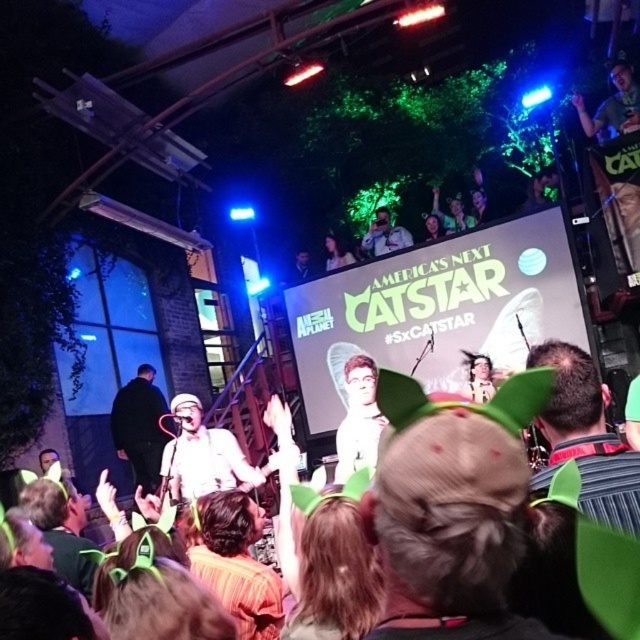
Question: Which of the following is the farthest from the observer?

Choices:
 (A) (595, 448)
 (B) (204, 432)
 (C) (374, 378)

Answer: (B)

Question: Is striped shirt at lower center bigger than smooth white shirt at center?

Choices:
 (A) no
 (B) yes

Answer: (A)

Question: Is striped shirt at lower center above white matte microphone at center?

Choices:
 (A) yes
 (B) no

Answer: (A)

Question: Which point appears closest to the camera in this image?

Choices:
 (A) (234, 460)
 (B) (348, 477)
 (C) (563, 417)
 (D) (124, 413)

Answer: (C)

Question: Which is nearer to the striped shirt at lower center?

Choices:
 (A) white matte microphone at center
 (B) dark brown hair at center
 (C) smooth white shirt at center
 (D) dark gray fabric jacket at center

Answer: (C)

Question: Does dark brown hair at center appear on the right side of dark gray fabric jacket at center?

Choices:
 (A) no
 (B) yes

Answer: (B)